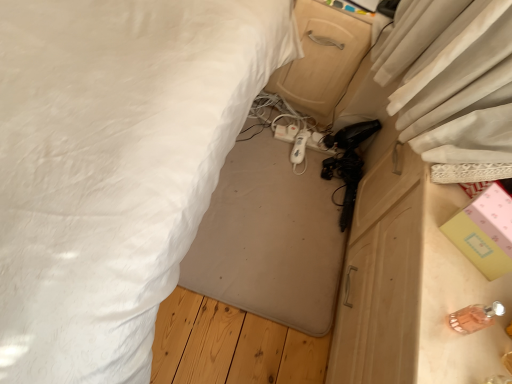
Question: From a real-world perspective, is white fabric bed at center above or below translucent glass perfume bottle at lower right, the 2th equipment positioned from the left?

Choices:
 (A) above
 (B) below

Answer: (B)

Question: Is point tap(18, 87) closer or farther from the camera than point tap(462, 311)?

Choices:
 (A) closer
 (B) farther

Answer: (B)

Question: Based on their relative distances, which object is nearer to the white matte remote control at center, positioned as the 2th equipment in right-to-left order?

Choices:
 (A) white plastic extension cord at center
 (B) translucent glass perfume bottle at lower right, the 2th equipment positioned from the left
 (C) wooden drawer at center
 (D) pink paper box at right
 (E) white fabric bed at center

Answer: (A)

Question: Considering the real-world distances, which object is closest to the wooden drawer at center?

Choices:
 (A) pink paper box at right
 (B) white matte remote control at center, positioned as the first equipment in top-to-bottom order
 (C) white fabric bed at center
 (D) white plastic extension cord at center
 (E) translucent glass perfume bottle at lower right, the second equipment in the top-to-bottom sequence

Answer: (D)